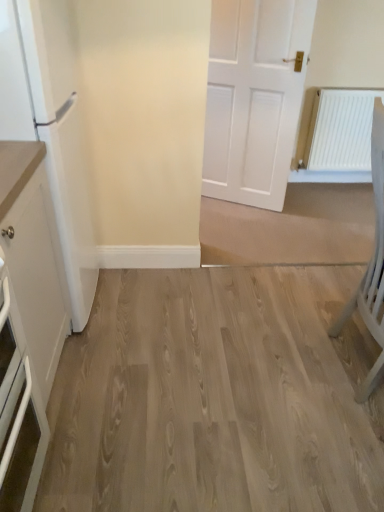
Where is `free region under white matte radiator at right (from a real-world perspective)`? The image size is (384, 512). free region under white matte radiator at right (from a real-world perspective) is located at coordinates (331, 184).